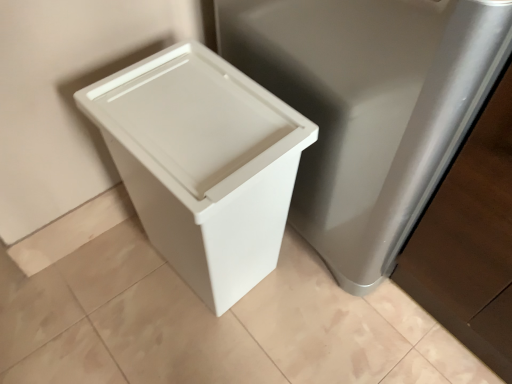
At what (x,y) coordinates should I click in order to perform the action: click on vacant area in front of white plastic waste container at left. Please return your answer as a coordinate pair (x, y). This screenshot has height=384, width=512. Looking at the image, I should click on (199, 345).